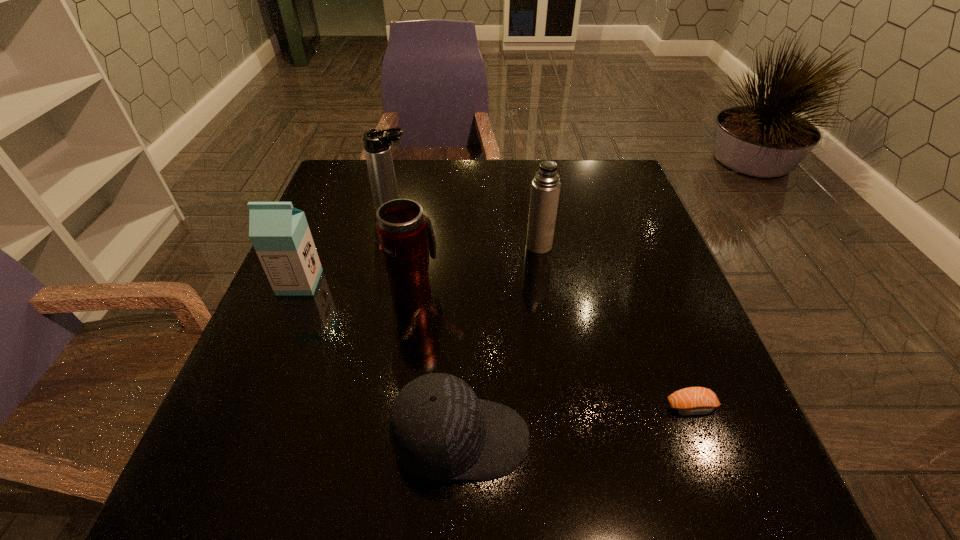
The width and height of the screenshot is (960, 540). I want to click on free space that satisfies the following two spatial constraints: 1. on the handle side of the second farthest object; 2. on the right side of the farthest object, so click(385, 246).

Locate an element on the screen. The width and height of the screenshot is (960, 540). vacant point that satisfies the following two spatial constraints: 1. on the handle side of the farthest thermos bottle; 2. on the side with the handle of the nearest thermos bottle is located at coordinates (373, 294).

Locate an element on the screen. The image size is (960, 540). free space that satisfies the following two spatial constraints: 1. on the handle side of the farthest thermos bottle; 2. on the side with the handle of the nearest thermos bottle is located at coordinates (373, 294).

Identify the location of free region that satisfies the following two spatial constraints: 1. on the side with the handle of the second farthest thermos bottle; 2. on the right side of the nearest thermos bottle. (421, 246).